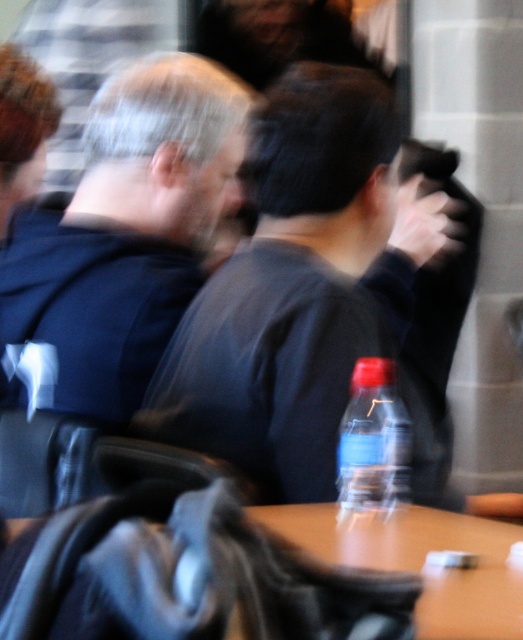
You are organizing a clothing donation drive and need to determine which items are larger. You see a dark gray sweater at center and a dark blue fabric at left in the image. Which one should you select if you need to choose the larger item?

The dark gray sweater at center is bigger than the dark blue fabric at left, so you should select the dark gray sweater at center.